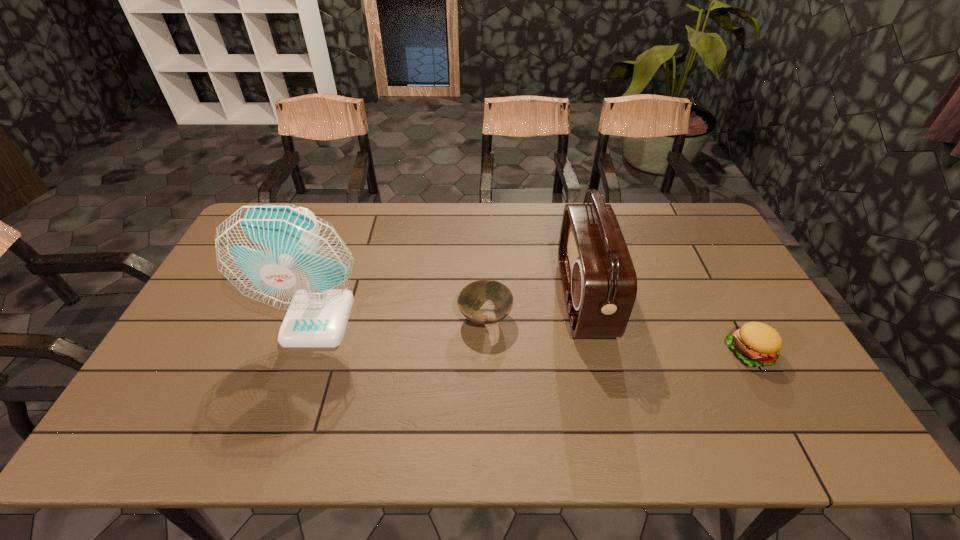
At what (x,y) coordinates should I click in order to perform the action: click on empty space between the tallest object and the second tallest object. Please return your answer as a coordinate pair (x, y). Looking at the image, I should click on (451, 308).

This screenshot has height=540, width=960. Find the location of `vacant area that lies between the radio receiver and the tallest object`. vacant area that lies between the radio receiver and the tallest object is located at coordinates (451, 308).

The image size is (960, 540). Find the location of `vacant space in between the fan and the third object from right to left`. vacant space in between the fan and the third object from right to left is located at coordinates (402, 318).

Where is `free space between the hamburger and the radio receiver`? free space between the hamburger and the radio receiver is located at coordinates coord(667,325).

The image size is (960, 540). I want to click on free space between the tallest object and the third object from right to left, so click(402, 318).

Locate an element on the screen. unoccupied position between the hamburger and the radio receiver is located at coordinates (667, 325).

Locate an element on the screen. object that is the third closest one to the radio receiver is located at coordinates (284, 256).

Select which object is the second closest to the tallest object. Please provide its 2D coordinates. Your answer should be formatted as a tuple, i.e. [(x, y)], where the tuple contains the x and y coordinates of a point satisfying the conditions above.

[(599, 281)]

Where is `vacant area in the image that satisfies the following two spatial constraints: 1. on the front panel of the radio receiver; 2. on the left side of the rightmost object`? vacant area in the image that satisfies the following two spatial constraints: 1. on the front panel of the radio receiver; 2. on the left side of the rightmost object is located at coordinates (597, 352).

Find the location of a particular element. free space that satisfies the following two spatial constraints: 1. on the front panel of the rightmost object; 2. on the left side of the radio receiver is located at coordinates (597, 352).